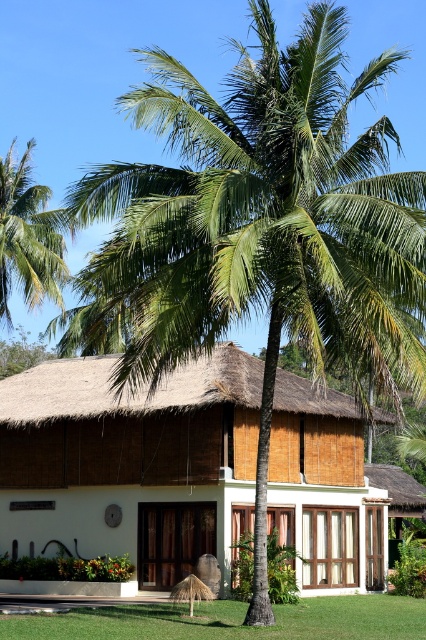
Question: Is white wood cottage at center further to camera compared to green grass at lower center?

Choices:
 (A) yes
 (B) no

Answer: (A)

Question: Which object is positioned closest to the green leafy palm tree at upper left?

Choices:
 (A) green grass at lower center
 (B) white wood cottage at center

Answer: (B)

Question: Which of the following is the closest to the observer?

Choices:
 (A) green leafy palm tree at upper left
 (B) green grass at lower center

Answer: (B)

Question: Is green grass at lower center smaller than green leafy palm tree at upper left?

Choices:
 (A) no
 (B) yes

Answer: (B)

Question: Which of the following is the closest to the observer?

Choices:
 (A) white wood cottage at center
 (B) green grass at lower center
 (C) green leafy palm tree at upper left

Answer: (B)

Question: Where is white wood cottage at center located in relation to green leafy palm tree at upper left in the image?

Choices:
 (A) below
 (B) above

Answer: (A)